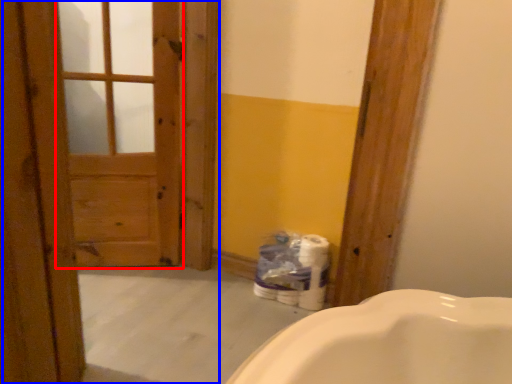
Question: Which of the following is the farthest to the observer, screen door (highlighted by a red box) or barn door (highlighted by a blue box)?

Choices:
 (A) screen door
 (B) barn door

Answer: (A)